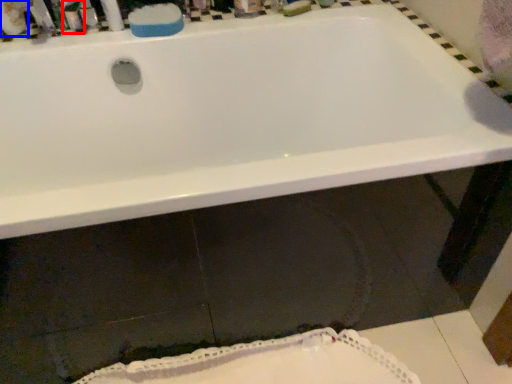
Question: Which object appears farthest to the camera in this image, toiletry (highlighted by a red box) or mouthwash (highlighted by a blue box)?

Choices:
 (A) toiletry
 (B) mouthwash

Answer: (A)